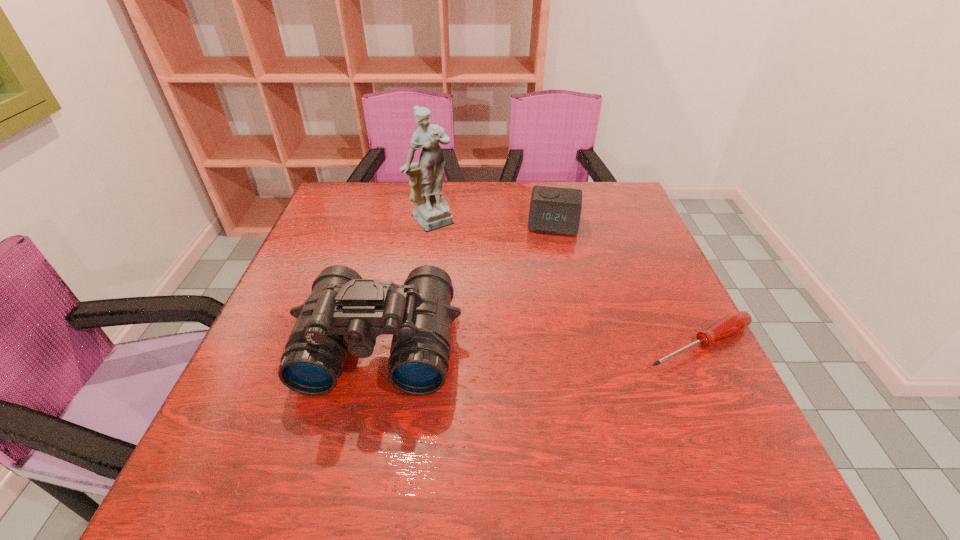
Image resolution: width=960 pixels, height=540 pixels. Find the location of `the third shortest object`. the third shortest object is located at coordinates (344, 314).

This screenshot has width=960, height=540. I want to click on the rightmost object, so click(734, 323).

Where is `screwdriver`? This screenshot has width=960, height=540. screwdriver is located at coordinates (734, 323).

Identify the location of the second object from right to left. The image size is (960, 540). (554, 210).

The width and height of the screenshot is (960, 540). Find the location of `alarm clock`. alarm clock is located at coordinates (554, 210).

The width and height of the screenshot is (960, 540). I want to click on the tallest object, so click(x=431, y=210).

This screenshot has height=540, width=960. I want to click on vacant space located on the back of the shortest object, so click(x=654, y=251).

Identify the location of vacant space positioned 0.250m on the front-facing side of the second shortest object. This screenshot has height=540, width=960. (543, 299).

Identify the location of free region located on the front-facing side of the second shortest object. This screenshot has height=540, width=960. (549, 254).

Locate an element on the screen. This screenshot has height=540, width=960. free spot located 0.130m on the front-facing side of the second shortest object is located at coordinates (547, 266).